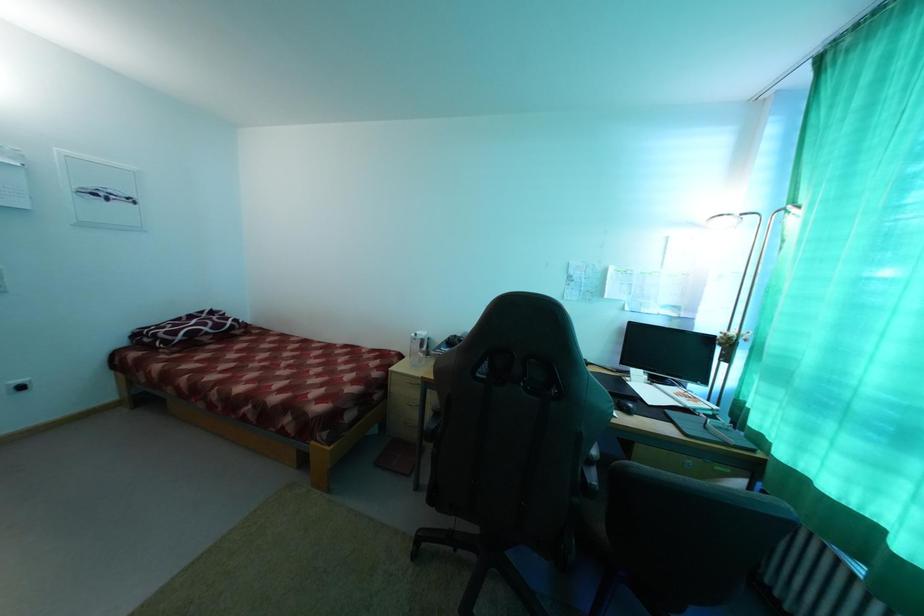
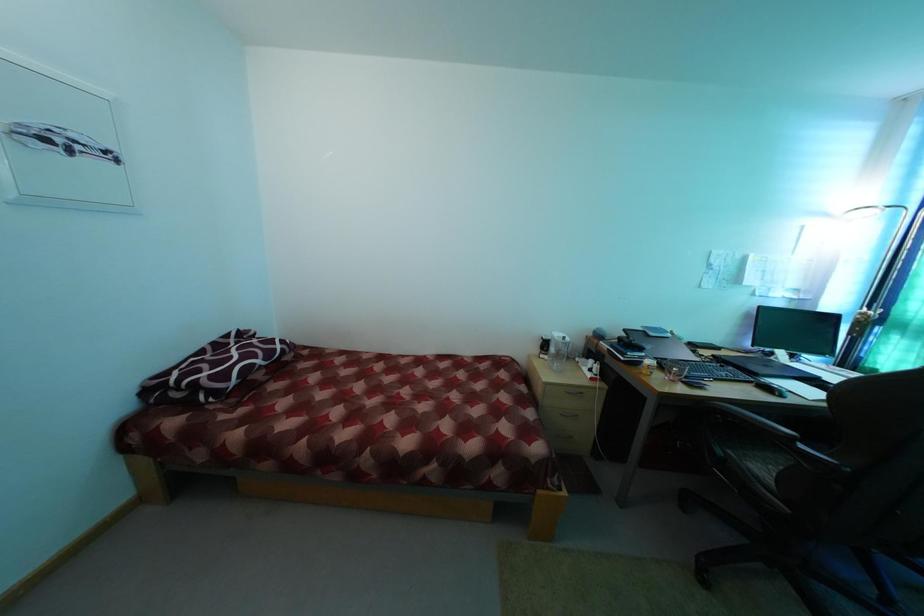
Question: In a continuous first-person perspective shot, in which direction is the camera moving?

Choices:
 (A) Left
 (B) Right
 (C) Forward
 (D) Backward

Answer: (A)